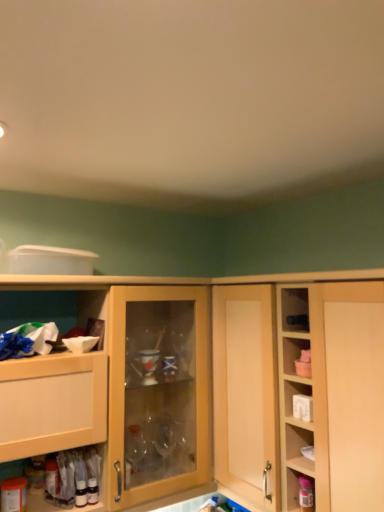
Question: Is matte plastic container at lower right further to the viewer compared to white plastic plug at upper right?

Choices:
 (A) yes
 (B) no

Answer: (B)

Question: Is matte plastic container at lower right far from white plastic plug at upper right?

Choices:
 (A) no
 (B) yes

Answer: (A)

Question: Can you confirm if matte plastic container at lower right is thinner than white plastic plug at upper right?

Choices:
 (A) yes
 (B) no

Answer: (A)

Question: Could you tell me if matte plastic container at lower right is turned towards white plastic plug at upper right?

Choices:
 (A) yes
 (B) no

Answer: (B)

Question: Is matte plastic container at lower right positioned beyond the bounds of white plastic plug at upper right?

Choices:
 (A) no
 (B) yes

Answer: (B)

Question: Is point (312, 295) positioned closer to the camera than point (97, 287)?

Choices:
 (A) farther
 (B) closer

Answer: (B)

Question: Based on their sizes in the image, would you say light wood cabinet at center, which is the 2th cabinetry in left-to-right order, is bigger or smaller than light wood cabinet at left, the 1th cabinetry viewed from the left?

Choices:
 (A) big
 (B) small

Answer: (B)

Question: From a real-world perspective, relative to light wood cabinet at left, placed as the 2th cabinetry when sorted from right to left, is light wood cabinet at center, arranged as the first cabinetry when viewed from the right, vertically above or below?

Choices:
 (A) below
 (B) above

Answer: (B)

Question: Which is correct: light wood cabinet at center, which is the 2th cabinetry in left-to-right order, is inside light wood cabinet at left, placed as the 2th cabinetry when sorted from right to left, or outside of it?

Choices:
 (A) outside
 (B) inside

Answer: (A)

Question: Is light wood cabinet at left, the 1th cabinetry viewed from the left, to the left or to the right of light wood cabinet at center, arranged as the first cabinetry when viewed from the right, in the image?

Choices:
 (A) left
 (B) right

Answer: (A)

Question: From the image's perspective, is light wood cabinet at left, the 1th cabinetry viewed from the left, located above or below light wood cabinet at center, arranged as the first cabinetry when viewed from the right?

Choices:
 (A) above
 (B) below

Answer: (B)

Question: Considering their positions, is light wood cabinet at left, the 1th cabinetry viewed from the left, located in front of or behind light wood cabinet at center, which is the 2th cabinetry in left-to-right order?

Choices:
 (A) front
 (B) behind

Answer: (B)

Question: In terms of height, does light wood cabinet at left, placed as the 2th cabinetry when sorted from right to left, look taller or shorter compared to light wood cabinet at center, arranged as the first cabinetry when viewed from the right?

Choices:
 (A) tall
 (B) short

Answer: (B)

Question: In the image, is white plastic plug at upper right positioned in front of or behind matte plastic container at lower right?

Choices:
 (A) front
 (B) behind

Answer: (B)

Question: Choose the correct answer: Is white plastic plug at upper right inside matte plastic container at lower right or outside it?

Choices:
 (A) inside
 (B) outside

Answer: (B)